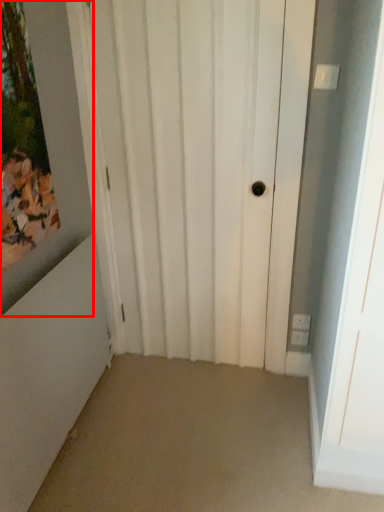
Question: From the image's perspective, what is the correct spatial positioning of picture frame (annotated by the red box) in reference to door?

Choices:
 (A) above
 (B) below

Answer: (A)